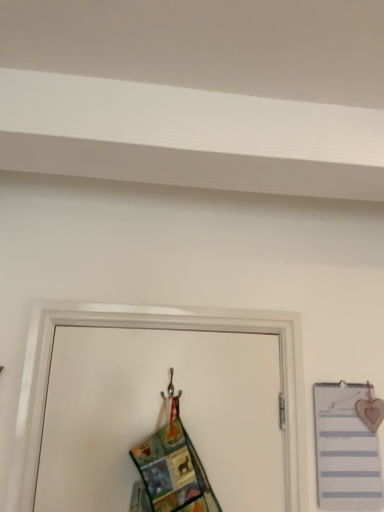
Question: Is multicolored fabric at center aimed at white striped notebook at right?

Choices:
 (A) yes
 (B) no

Answer: (B)

Question: Is multicolored fabric at center outside of white striped notebook at right?

Choices:
 (A) no
 (B) yes

Answer: (B)

Question: Does multicolored fabric at center have a smaller size compared to white striped notebook at right?

Choices:
 (A) no
 (B) yes

Answer: (A)

Question: Is multicolored fabric at center positioned with its back to white striped notebook at right?

Choices:
 (A) no
 (B) yes

Answer: (A)

Question: Is multicolored fabric at center far away from white striped notebook at right?

Choices:
 (A) no
 (B) yes

Answer: (A)

Question: From the image's perspective, does multicolored fabric at center appear higher than white striped notebook at right?

Choices:
 (A) yes
 (B) no

Answer: (A)

Question: Can you confirm if white striped notebook at right is smaller than multicolored fabric at center?

Choices:
 (A) no
 (B) yes

Answer: (B)

Question: Is multicolored fabric at center a part of white striped notebook at right?

Choices:
 (A) yes
 (B) no

Answer: (B)

Question: Can you confirm if white striped notebook at right is positioned to the left of multicolored fabric at center?

Choices:
 (A) no
 (B) yes

Answer: (A)

Question: Considering the relative sizes of white striped notebook at right and multicolored fabric at center in the image provided, is white striped notebook at right wider than multicolored fabric at center?

Choices:
 (A) no
 (B) yes

Answer: (A)

Question: Is white striped notebook at right next to multicolored fabric at center?

Choices:
 (A) no
 (B) yes

Answer: (A)

Question: From the image's perspective, is white striped notebook at right over multicolored fabric at center?

Choices:
 (A) no
 (B) yes

Answer: (A)

Question: Is multicolored fabric at center taller or shorter than white striped notebook at right?

Choices:
 (A) short
 (B) tall

Answer: (A)